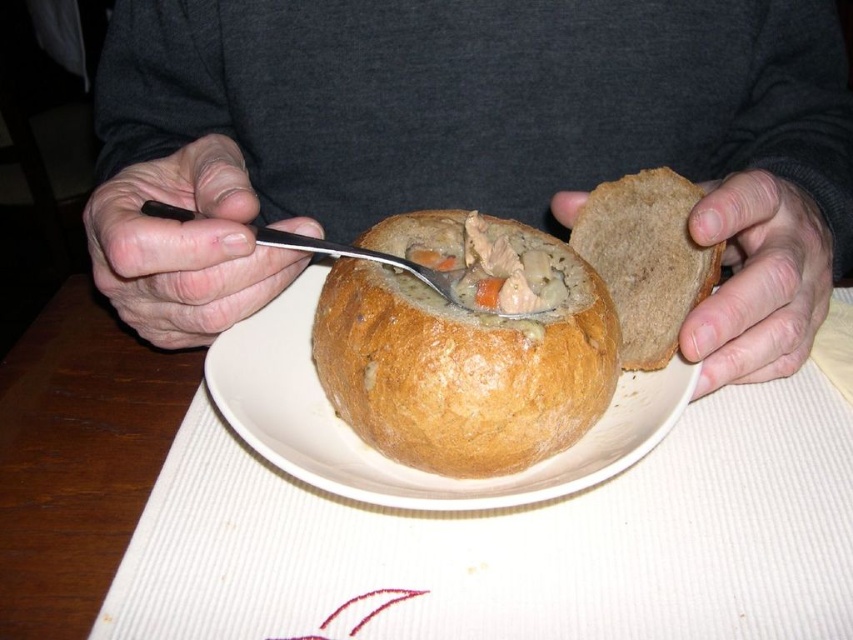
Between wooden table at center and dry skin at left, which one is positioned lower?

wooden table at center

Looking at this image, is wooden table at center further to camera compared to dry skin at left?

No, wooden table at center is closer to the viewer.

Between point (13, 596) and point (241, 234), which one is positioned in front?

Point (13, 596) is more forward.

I want to click on wooden table at center, so click(77, 458).

Is point (305, 442) closer to camera compared to point (740, 180)?

Yes.

Who is more forward, (x=515, y=480) or (x=740, y=312)?

Positioned in front is point (x=515, y=480).

At what (x,y) coordinates should I click in order to perform the action: click on white ceramic plate at center. Please return your answer as a coordinate pair (x, y). Image resolution: width=853 pixels, height=640 pixels. Looking at the image, I should click on (389, 458).

Does wooden table at center have a lesser height compared to white ceramic plate at center?

No, wooden table at center is not shorter than white ceramic plate at center.

Which of these two, wooden table at center or white ceramic plate at center, stands shorter?

white ceramic plate at center

Image resolution: width=853 pixels, height=640 pixels. What do you see at coordinates (77, 458) in the screenshot?
I see `wooden table at center` at bounding box center [77, 458].

Where is `wooden table at center`? The width and height of the screenshot is (853, 640). wooden table at center is located at coordinates (77, 458).